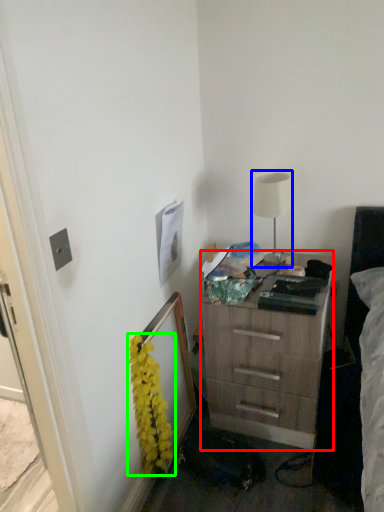
Question: Which is farther away from chest of drawers (highlighted by a red box)? table lamp (highlighted by a blue box) or flower (highlighted by a green box)?

Choices:
 (A) table lamp
 (B) flower

Answer: (B)